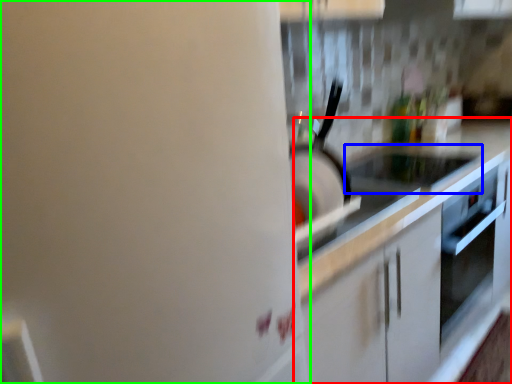
Question: Based on their relative distances, which object is nearer to countertop (highlighted by a red box)? Choose from appliance (highlighted by a blue box) and home appliance (highlighted by a green box).

Choices:
 (A) appliance
 (B) home appliance

Answer: (A)